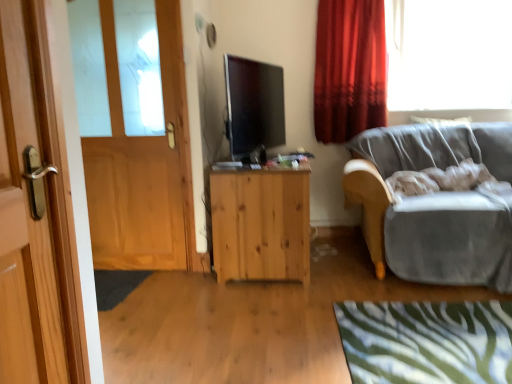
You are a GUI agent. You are given a task and a screenshot of the screen. Output one action in this format:
    pyautogui.click(x=<x>, y=<y>)
    Task: Click on the vacant area that lies between wooden door at left, which ranks as the 1th door in left-to-right order, and green zebra-patterned rug at lower right
    The width and height of the screenshot is (512, 384).
    Given the screenshot: What is the action you would take?
    pyautogui.click(x=281, y=307)